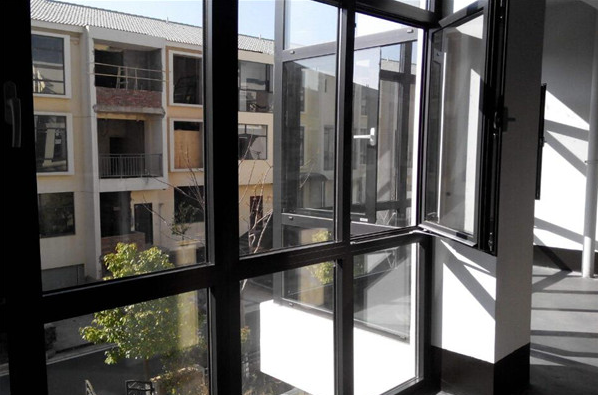
The image size is (598, 395). I want to click on open window, so click(x=462, y=142), click(x=543, y=132).